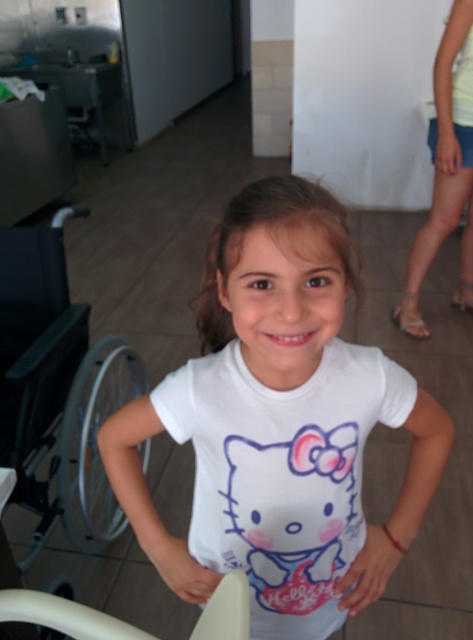
Based on the photo, does white matte t-shirt at center come behind white cotton t-shirt at center?

That is False.

Which is below, white matte t-shirt at center or white cotton t-shirt at center?

Positioned lower is white cotton t-shirt at center.

Where is `white matte t-shirt at center`? This screenshot has width=473, height=640. white matte t-shirt at center is located at coordinates (280, 424).

Based on the photo, is white cotton t-shirt at center shorter than light yellow fabric shorts at right?

Indeed, white cotton t-shirt at center has a lesser height compared to light yellow fabric shorts at right.

Is point (375, 396) less distant than point (462, 177)?

Yes, point (375, 396) is closer to viewer.

Locate an element on the screen. Image resolution: width=473 pixels, height=640 pixels. white cotton t-shirt at center is located at coordinates (281, 474).

Between silver metallic wheelchair at left and white plastic chair at lower center, which one appears on the left side from the viewer's perspective?

silver metallic wheelchair at left is more to the left.

Does silver metallic wheelchair at left have a greater height compared to white plastic chair at lower center?

→ Yes.

You are a GUI agent. You are given a task and a screenshot of the screen. Output one action in this format:
    pyautogui.click(x=<x>, y=<y>)
    Task: Click on the silver metallic wheelchair at left
    This screenshot has width=473, height=640.
    Given the screenshot: What is the action you would take?
    pyautogui.click(x=58, y=388)

You are a GUI agent. You are given a task and a screenshot of the screen. Output one action in this format:
    pyautogui.click(x=<x>, y=<y>)
    Task: Click on the silver metallic wheelchair at left
    This screenshot has height=640, width=473.
    Given the screenshot: What is the action you would take?
    pyautogui.click(x=58, y=388)